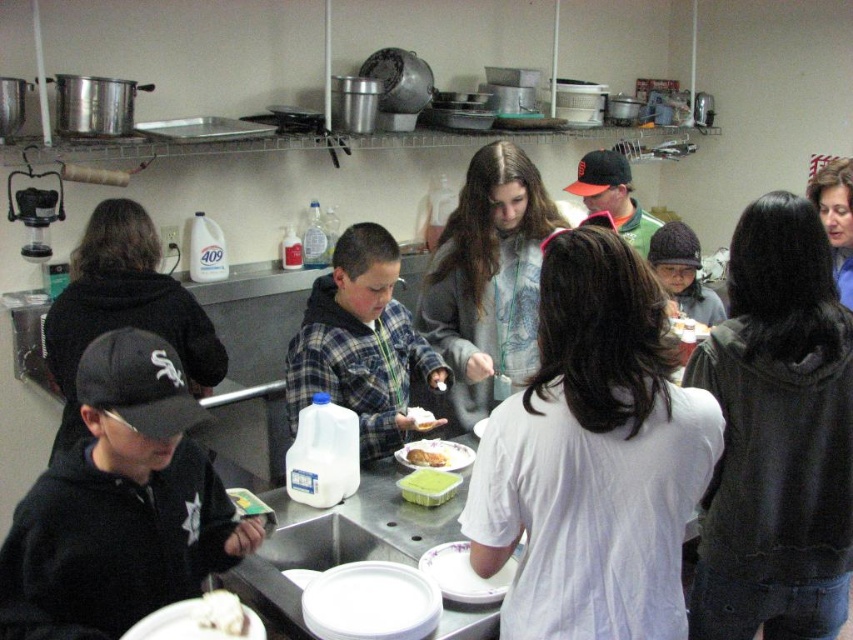
Question: Can you confirm if green plastic container at center is bigger than white matte bread at center?

Choices:
 (A) yes
 (B) no

Answer: (A)

Question: Which point is closer to the camera taking this photo?

Choices:
 (A) (409, 499)
 (B) (223, 604)
 (C) (430, 428)
 (D) (779, 522)

Answer: (B)

Question: Is yellowish matte plate at center bigger than green plastic container at center?

Choices:
 (A) no
 (B) yes

Answer: (B)

Question: Is black fuzzy hoodie at upper right bigger than green matte bread at center?

Choices:
 (A) yes
 (B) no

Answer: (A)

Question: Which object is the farthest from the green plastic container at center?

Choices:
 (A) white creamy cake at center
 (B) white matte bread at center

Answer: (A)

Question: Which of these objects is positioned closest to the white matte bread at center?

Choices:
 (A) white creamy cake at center
 (B) yellowish matte plate at center

Answer: (B)